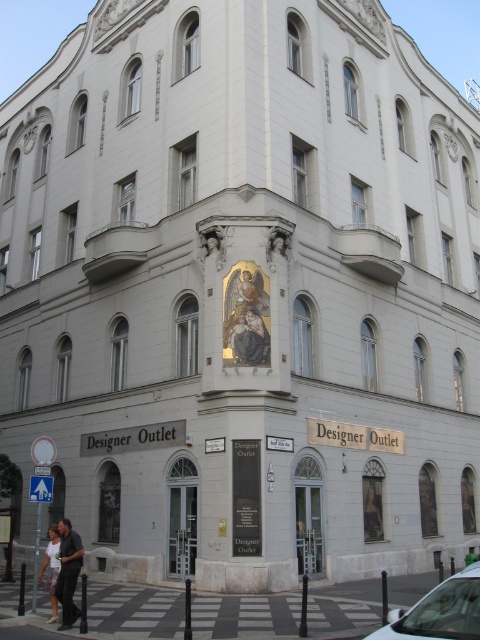
You are a delivery person standing at the entrance of the building and need to place two packages. One is for the dark gray pants at lower left and the other for the light pink fabric pants at lower left. If your delivery cart is 3 feet wide, can you maneuver between them?

The distance between the dark gray pants at lower left and the light pink fabric pants at lower left is 4.64 feet. Since the cart is 3 feet wide, there is enough space to maneuver between them as 4.64 feet is greater than 3 feet.